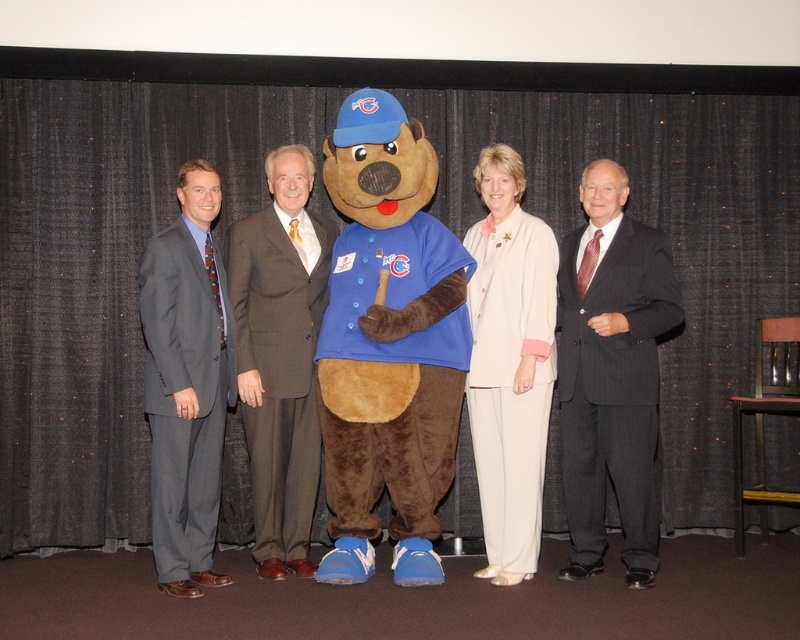
Is dark gray pinstripe suit at right in front of light beige fabric suit at center?

Yes.

Is point (580, 243) behind point (484, 348)?

Yes, point (580, 243) is farther from viewer.

At what (x,y) coordinates should I click in order to perform the action: click on dark gray pinstripe suit at right. Please return your answer as a coordinate pair (x, y). Image resolution: width=800 pixels, height=640 pixels. Looking at the image, I should click on (612, 374).

Which is below, brown plush teddy bear at center or light beige fabric suit at center?

light beige fabric suit at center is lower down.

Who is shorter, brown plush teddy bear at center or light beige fabric suit at center?

Standing shorter between the two is light beige fabric suit at center.

Does point (356, 288) come closer to viewer compared to point (498, 241)?

Yes.

At what (x,y) coordinates should I click in order to perform the action: click on brown plush teddy bear at center. Please return your answer as a coordinate pair (x, y). Looking at the image, I should click on (388, 342).

Can you confirm if dark gray pinstripe suit at right is wider than brown wool suit at center?

Yes, dark gray pinstripe suit at right is wider than brown wool suit at center.

Is point (584, 486) closer to viewer compared to point (296, 212)?

Yes, it is.

Where is `dark gray pinstripe suit at right`? The image size is (800, 640). dark gray pinstripe suit at right is located at coordinates (612, 374).

Where is `dark gray pinstripe suit at right`? The image size is (800, 640). dark gray pinstripe suit at right is located at coordinates 612,374.